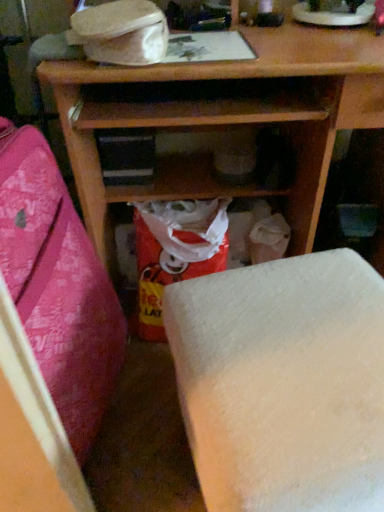
Describe the element at coordinates (175, 251) in the screenshot. The image size is (384, 512). I see `matte plastic bag at center` at that location.

Measure the distance between point (72, 222) and camera.

Point (72, 222) and camera are 91.40 centimeters apart from each other.

Where is `matte plastic bag at center`? Image resolution: width=384 pixels, height=512 pixels. matte plastic bag at center is located at coordinates (175, 251).

Are white matte foam at lower center, placed as the first furniture when sorted from right to left, and wooden shelf at center, marked as the first furniture in a left-to-right arrangement, beside each other?

No.

Is white matte foam at lower center, which appears as the 2th furniture when viewed from the left, positioned beyond the bounds of wooden shelf at center, which ranks as the 2th furniture in right-to-left order?

Absolutely, white matte foam at lower center, which appears as the 2th furniture when viewed from the left, is external to wooden shelf at center, which ranks as the 2th furniture in right-to-left order.

From a real-world perspective, between white matte foam at lower center, placed as the first furniture when sorted from right to left, and wooden shelf at center, which ranks as the 2th furniture in right-to-left order, who is vertically higher?

wooden shelf at center, which ranks as the 2th furniture in right-to-left order, from a real-world perspective.

From a real-world perspective, which is physically below, wooden shelf at center, marked as the first furniture in a left-to-right arrangement, or matte plastic bag at center?

matte plastic bag at center, from a real-world perspective.

Is wooden shelf at center, marked as the first furniture in a left-to-right arrangement, completely or partially outside of matte plastic bag at center?

Yes.

Can you tell me how much wooden shelf at center, marked as the first furniture in a left-to-right arrangement, and matte plastic bag at center differ in facing direction?

The angular difference between wooden shelf at center, marked as the first furniture in a left-to-right arrangement, and matte plastic bag at center is 78.9 degrees.

Is point (6, 493) closer or farther from the camera than point (220, 252)?

Clearly, point (6, 493) is closer to the camera than point (220, 252).

Which object is further away from the camera, matte plastic bag at center or white matte foam at lower center, which appears as the 2th furniture when viewed from the left?

Positioned behind is matte plastic bag at center.

Which of these two, matte plastic bag at center or white matte foam at lower center, which appears as the 2th furniture when viewed from the left, stands taller?

white matte foam at lower center, which appears as the 2th furniture when viewed from the left, is taller.

From a real-world perspective, which object stands above the other?

white matte foam at lower center, placed as the first furniture when sorted from right to left.

Is matte plastic bag at center in contact with white matte foam at lower center, which appears as the 2th furniture when viewed from the left?

No, matte plastic bag at center is not next to white matte foam at lower center, which appears as the 2th furniture when viewed from the left.

Is the depth of white matte foam at lower center, which appears as the 2th furniture when viewed from the left, greater than that of matte plastic bag at center?

No, it is not.

Considering the sizes of white matte foam at lower center, placed as the first furniture when sorted from right to left, and matte plastic bag at center in the image, is white matte foam at lower center, placed as the first furniture when sorted from right to left, wider or thinner than matte plastic bag at center?

Clearly, white matte foam at lower center, placed as the first furniture when sorted from right to left, has more width compared to matte plastic bag at center.

How different are the orientations of white matte foam at lower center, which appears as the 2th furniture when viewed from the left, and matte plastic bag at center in degrees?

8.17 degrees.

From the image's perspective, which is above, white matte foam at lower center, placed as the first furniture when sorted from right to left, or matte plastic bag at center?

matte plastic bag at center appears higher in the image.

Measure the distance between matte plastic bag at center and wooden shelf at center, marked as the first furniture in a left-to-right arrangement.

matte plastic bag at center is 11.98 inches away from wooden shelf at center, marked as the first furniture in a left-to-right arrangement.

Considering the sizes of objects matte plastic bag at center and wooden shelf at center, marked as the first furniture in a left-to-right arrangement, in the image provided, who is shorter, matte plastic bag at center or wooden shelf at center, marked as the first furniture in a left-to-right arrangement,?

matte plastic bag at center is shorter.

From a real-world perspective, is matte plastic bag at center physically located above or below wooden shelf at center, marked as the first furniture in a left-to-right arrangement?

matte plastic bag at center is situated lower than wooden shelf at center, marked as the first furniture in a left-to-right arrangement, in the real world.

Which is correct: wooden shelf at center, which ranks as the 2th furniture in right-to-left order, is inside white matte foam at lower center, which appears as the 2th furniture when viewed from the left, or outside of it?

wooden shelf at center, which ranks as the 2th furniture in right-to-left order, is spatially situated outside white matte foam at lower center, which appears as the 2th furniture when viewed from the left.

From a real-world perspective, is wooden shelf at center, marked as the first furniture in a left-to-right arrangement, beneath white matte foam at lower center, placed as the first furniture when sorted from right to left?

No, from a real-world perspective, wooden shelf at center, marked as the first furniture in a left-to-right arrangement, is not beneath white matte foam at lower center, placed as the first furniture when sorted from right to left.

Considering the sizes of objects wooden shelf at center, which ranks as the 2th furniture in right-to-left order, and white matte foam at lower center, placed as the first furniture when sorted from right to left, in the image provided, who is bigger, wooden shelf at center, which ranks as the 2th furniture in right-to-left order, or white matte foam at lower center, placed as the first furniture when sorted from right to left,?

wooden shelf at center, which ranks as the 2th furniture in right-to-left order, is bigger.

Who is shorter, wooden shelf at center, marked as the first furniture in a left-to-right arrangement, or white matte foam at lower center, which appears as the 2th furniture when viewed from the left?

white matte foam at lower center, which appears as the 2th furniture when viewed from the left, is shorter.

Image resolution: width=384 pixels, height=512 pixels. Identify the location of furniture that is behind the wooden shelf at center, which ranks as the 2th furniture in right-to-left order. (283, 383).

Where is `the 2nd furniture in front of the matte plastic bag at center, starting your count from the anchor`? This screenshot has height=512, width=384. the 2nd furniture in front of the matte plastic bag at center, starting your count from the anchor is located at coordinates (49, 332).

Based on their spatial positions, is matte plastic bag at center or wooden shelf at center, marked as the first furniture in a left-to-right arrangement, closer to white matte foam at lower center, placed as the first furniture when sorted from right to left?

wooden shelf at center, marked as the first furniture in a left-to-right arrangement, is closer to white matte foam at lower center, placed as the first furniture when sorted from right to left.

From the image, which object appears to be farther from wooden shelf at center, marked as the first furniture in a left-to-right arrangement, matte plastic bag at center or white matte foam at lower center, which appears as the 2th furniture when viewed from the left?

Among the two, white matte foam at lower center, which appears as the 2th furniture when viewed from the left, is located further to wooden shelf at center, marked as the first furniture in a left-to-right arrangement.

Estimate the real-world distances between objects in this image. Which object is closer to matte plastic bag at center, wooden shelf at center, marked as the first furniture in a left-to-right arrangement, or white matte foam at lower center, which appears as the 2th furniture when viewed from the left?

wooden shelf at center, marked as the first furniture in a left-to-right arrangement, lies closer to matte plastic bag at center than the other object.

Which object lies nearer to the anchor point matte plastic bag at center, white matte foam at lower center, placed as the first furniture when sorted from right to left, or wooden shelf at center, which ranks as the 2th furniture in right-to-left order?

Based on the image, wooden shelf at center, which ranks as the 2th furniture in right-to-left order, appears to be nearer to matte plastic bag at center.

In the scene shown: Looking at the image, which one is located further to white matte foam at lower center, which appears as the 2th furniture when viewed from the left, wooden shelf at center, marked as the first furniture in a left-to-right arrangement, or matte plastic bag at center?

matte plastic bag at center.

Based on their spatial positions, is white matte foam at lower center, placed as the first furniture when sorted from right to left, or matte plastic bag at center closer to wooden shelf at center, marked as the first furniture in a left-to-right arrangement?

The object closer to wooden shelf at center, marked as the first furniture in a left-to-right arrangement, is matte plastic bag at center.

Find the location of a particular element. Image resolution: width=384 pixels, height=512 pixels. furniture between wooden shelf at center, marked as the first furniture in a left-to-right arrangement, and matte plastic bag at center, along the z-axis is located at coordinates (283, 383).